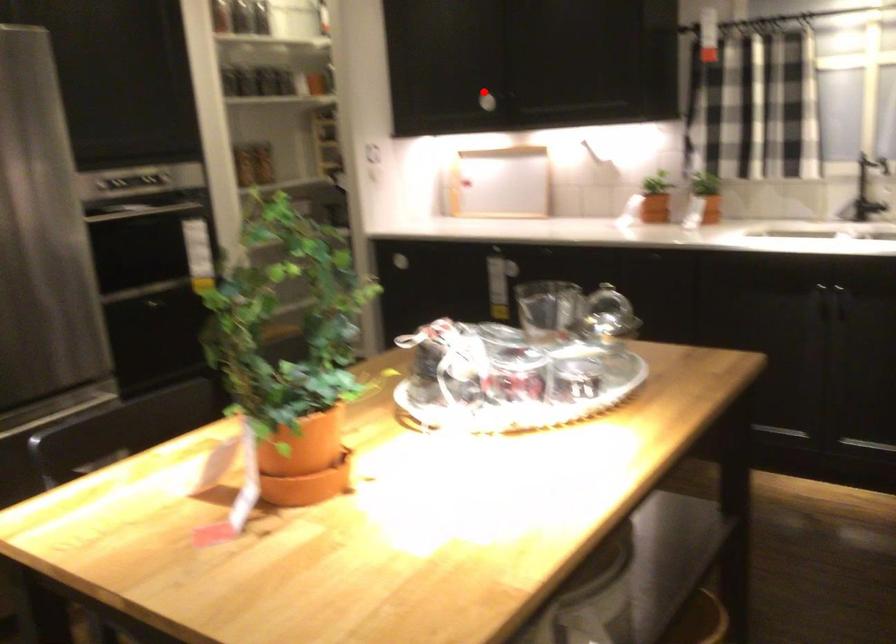
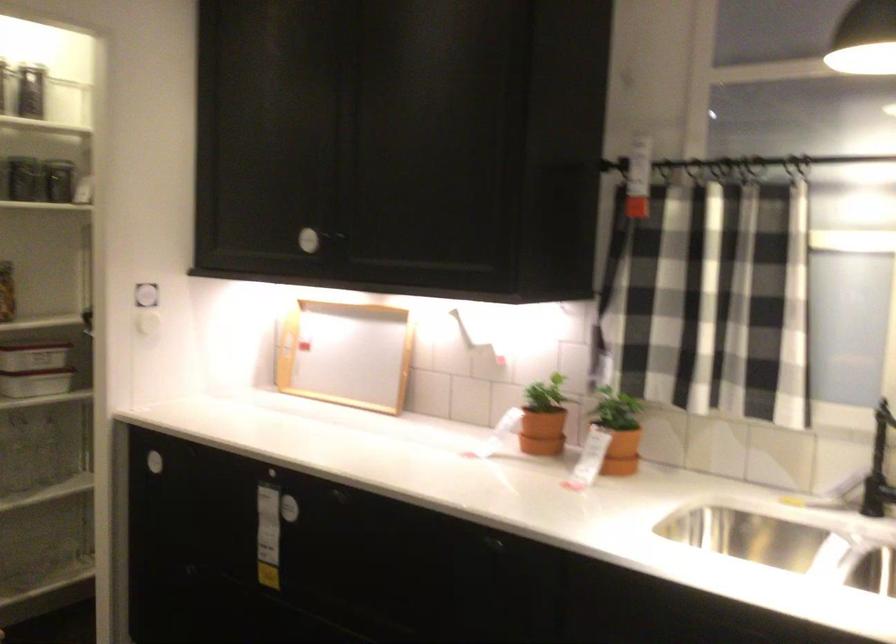
In the second image, find the point that corresponds to the highlighted location in the first image.

(307, 240)